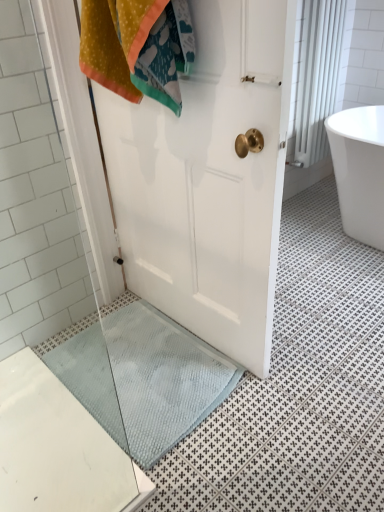
Question: Considering the relative sizes of light blue textured bath mat at lower center and white textured curtain at upper right in the image provided, is light blue textured bath mat at lower center taller than white textured curtain at upper right?

Choices:
 (A) yes
 (B) no

Answer: (B)

Question: Is the position of light blue textured bath mat at lower center more distant than that of white textured curtain at upper right?

Choices:
 (A) yes
 (B) no

Answer: (B)

Question: Is light blue textured bath mat at lower center smaller than white textured curtain at upper right?

Choices:
 (A) no
 (B) yes

Answer: (B)

Question: Does light blue textured bath mat at lower center appear on the left side of white textured curtain at upper right?

Choices:
 (A) yes
 (B) no

Answer: (A)

Question: From the image's perspective, is light blue textured bath mat at lower center under white textured curtain at upper right?

Choices:
 (A) no
 (B) yes

Answer: (B)

Question: Is point (148, 373) positioned closer to the camera than point (306, 105)?

Choices:
 (A) closer
 (B) farther

Answer: (A)

Question: Considering their positions, is light blue textured bath mat at lower center located in front of or behind white textured curtain at upper right?

Choices:
 (A) behind
 (B) front

Answer: (B)

Question: Is light blue textured bath mat at lower center to the left or to the right of white textured curtain at upper right in the image?

Choices:
 (A) right
 (B) left

Answer: (B)

Question: Looking at their shapes, would you say light blue textured bath mat at lower center is wider or thinner than white textured curtain at upper right?

Choices:
 (A) wide
 (B) thin

Answer: (A)

Question: Is light blue textured bath mat at lower center bigger or smaller than white glossy bathtub at right?

Choices:
 (A) big
 (B) small

Answer: (B)

Question: From a real-world perspective, is light blue textured bath mat at lower center positioned above or below white glossy bathtub at right?

Choices:
 (A) above
 (B) below

Answer: (B)

Question: Is point (152, 416) closer or farther from the camera than point (375, 195)?

Choices:
 (A) closer
 (B) farther

Answer: (A)

Question: Which is correct: light blue textured bath mat at lower center is inside white glossy bathtub at right, or outside of it?

Choices:
 (A) outside
 (B) inside

Answer: (A)

Question: Is white textured curtain at upper right inside the boundaries of light blue textured bath mat at lower center, or outside?

Choices:
 (A) inside
 (B) outside

Answer: (B)

Question: In terms of width, does white textured curtain at upper right look wider or thinner when compared to light blue textured bath mat at lower center?

Choices:
 (A) thin
 (B) wide

Answer: (A)